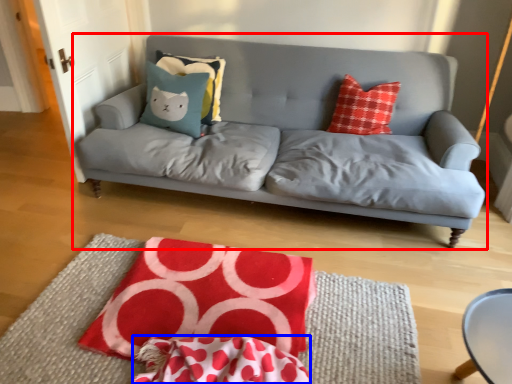
Question: Which point is closer to the camera, studio couch (highlighted by a red box) or material (highlighted by a blue box)?

Choices:
 (A) studio couch
 (B) material

Answer: (B)